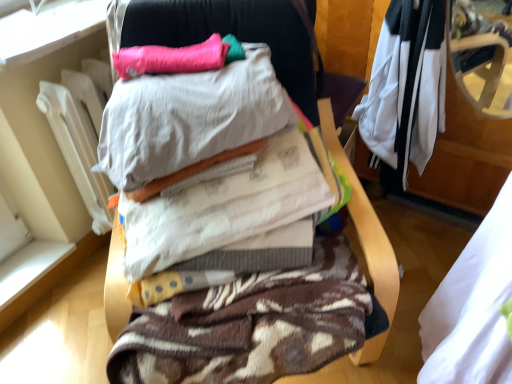
Question: Could you tell me if white/black fabric jacket at upper right, the 1th clothing when ordered from back to front, is facing pink fluffy pillow at upper center, which ranks as the first pillow in back-to-front order?

Choices:
 (A) no
 (B) yes

Answer: (A)

Question: Are white/black fabric jacket at upper right, the fourth clothing when ordered from front to back, and pink fluffy pillow at upper center, which ranks as the first pillow in back-to-front order, located far from each other?

Choices:
 (A) no
 (B) yes

Answer: (A)

Question: Is the position of white/black fabric jacket at upper right, the fourth clothing when ordered from front to back, less distant than that of pink fluffy pillow at upper center, positioned as the second pillow in front-to-back order?

Choices:
 (A) no
 (B) yes

Answer: (A)

Question: Is white/black fabric jacket at upper right, the 1th clothing when ordered from back to front, wider than pink fluffy pillow at upper center, positioned as the second pillow in front-to-back order?

Choices:
 (A) no
 (B) yes

Answer: (B)

Question: Can you confirm if white/black fabric jacket at upper right, the fourth clothing when ordered from front to back, is thinner than pink fluffy pillow at upper center, which ranks as the first pillow in back-to-front order?

Choices:
 (A) no
 (B) yes

Answer: (A)

Question: From the image's perspective, is white fabric at right, the fourth clothing from the back, positioned above or below white cotton sheets at center, the 3th clothing when ordered from back to front?

Choices:
 (A) above
 (B) below

Answer: (B)

Question: Considering the positions of white fabric at right, placed as the 1th clothing when sorted from front to back, and white cotton sheets at center, which is the second clothing in front-to-back order, in the image, is white fabric at right, placed as the 1th clothing when sorted from front to back, taller or shorter than white cotton sheets at center, which is the second clothing in front-to-back order,?

Choices:
 (A) short
 (B) tall

Answer: (B)

Question: Considering the positions of point (502, 208) and point (193, 210), is point (502, 208) closer or farther from the camera than point (193, 210)?

Choices:
 (A) closer
 (B) farther

Answer: (B)

Question: Is white fabric at right, placed as the 1th clothing when sorted from front to back, situated inside white cotton sheets at center, which is the second clothing in front-to-back order, or outside?

Choices:
 (A) inside
 (B) outside

Answer: (B)

Question: Does point (117, 185) appear closer or farther from the camera than point (116, 327)?

Choices:
 (A) closer
 (B) farther

Answer: (A)

Question: Relative to brown textured blanket at center, is soft cotton pillow at center, the 1th pillow viewed from the front, in front or behind?

Choices:
 (A) front
 (B) behind

Answer: (B)

Question: From the image's perspective, relative to brown textured blanket at center, is soft cotton pillow at center, the 1th pillow viewed from the front, above or below?

Choices:
 (A) below
 (B) above

Answer: (B)

Question: Would you say soft cotton pillow at center, the second pillow from the back, is to the left or to the right of brown textured blanket at center in the picture?

Choices:
 (A) right
 (B) left

Answer: (B)

Question: From their relative heights in the image, would you say white/black fabric jacket at upper right, the fourth clothing when ordered from front to back, is taller or shorter than white fabric at right, the fourth clothing from the back?

Choices:
 (A) short
 (B) tall

Answer: (A)

Question: In the image, is white/black fabric jacket at upper right, the 1th clothing when ordered from back to front, positioned in front of or behind white fabric at right, the fourth clothing from the back?

Choices:
 (A) front
 (B) behind

Answer: (B)